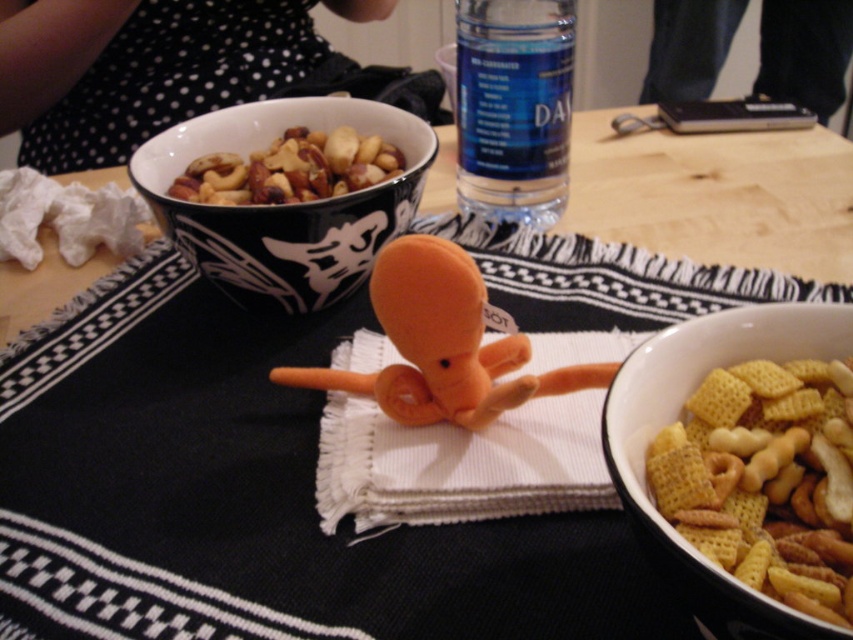
Describe the element at coordinates (459, 465) in the screenshot. I see `white woven cloth at center` at that location.

Based on the photo, does white woven cloth at center have a lesser width compared to matte black bowl at center?

No.

Where is `white woven cloth at center`? This screenshot has height=640, width=853. white woven cloth at center is located at coordinates (459, 465).

The height and width of the screenshot is (640, 853). I want to click on white woven cloth at center, so click(459, 465).

Between point (825, 321) and point (247, 198), which one is positioned in front?

Positioned in front is point (825, 321).

Locate an element on the screen. Image resolution: width=853 pixels, height=640 pixels. matte white bowl at lower right is located at coordinates click(x=683, y=420).

At what (x,y) coordinates should I click in order to perform the action: click on matte white bowl at lower right. Please return your answer as a coordinate pair (x, y). Looking at the image, I should click on tap(683, 420).

Locate an element on the screen. The width and height of the screenshot is (853, 640). matte white bowl at lower right is located at coordinates (683, 420).

Between white woven cloth at center and shiny brown nuts at upper center, which one has more height?

white woven cloth at center is taller.

Can you confirm if white woven cloth at center is positioned above shiny brown nuts at upper center?

Actually, white woven cloth at center is below shiny brown nuts at upper center.

Is point (669, 282) positioned before point (271, 166)?

No, (669, 282) is behind (271, 166).

Image resolution: width=853 pixels, height=640 pixels. Identify the location of white woven cloth at center. (459, 465).